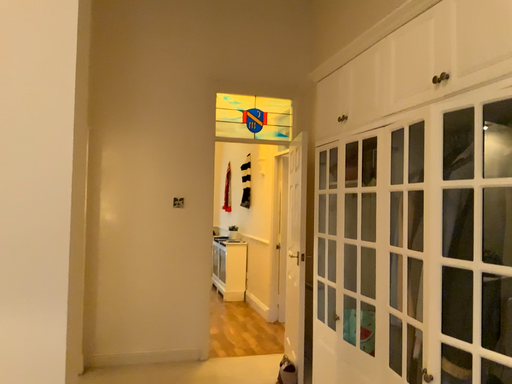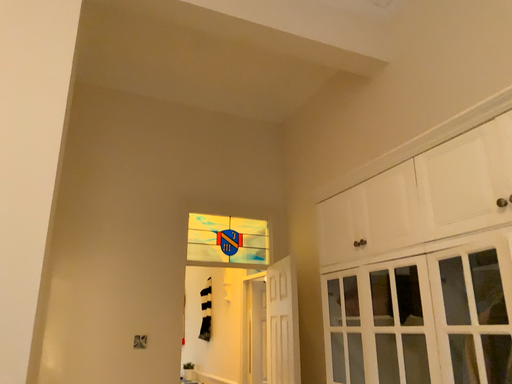
Question: How did the camera likely rotate when shooting the video?

Choices:
 (A) rotated upward
 (B) rotated downward

Answer: (A)